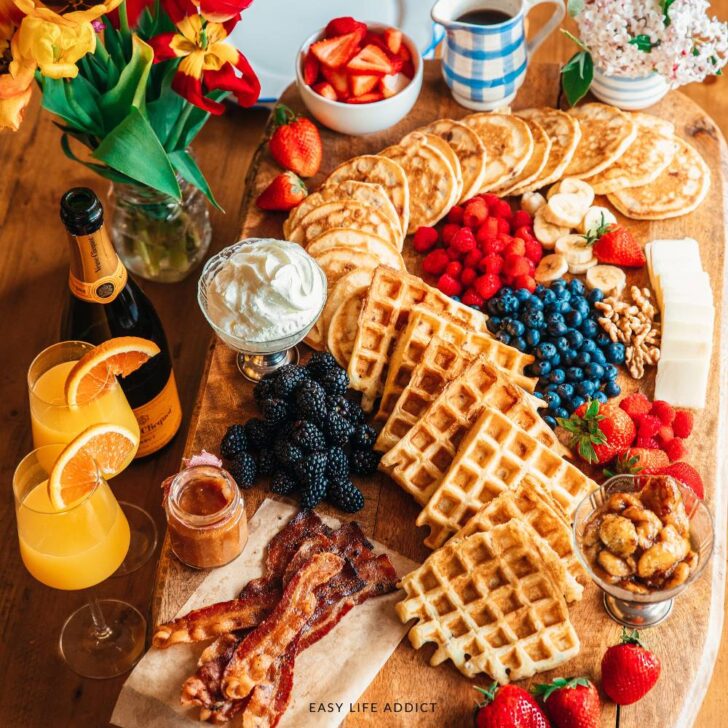
At what (x,y) coordinates should I click in order to perform the action: click on cutting board. Please return your answer as a coordinate pair (x, y). This screenshot has width=728, height=728. Looking at the image, I should click on (711, 221), (689, 641), (395, 526).